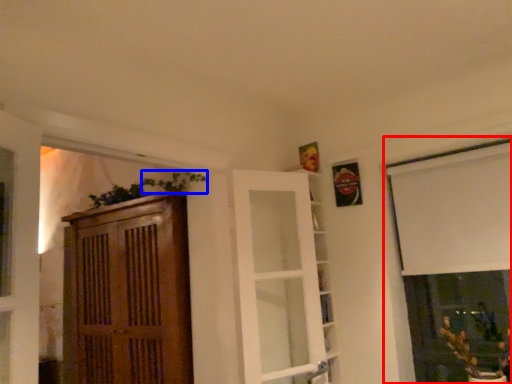
Question: Among these objects, which one is farthest to the camera, window (highlighted by a red box) or plant (highlighted by a blue box)?

Choices:
 (A) window
 (B) plant

Answer: (B)